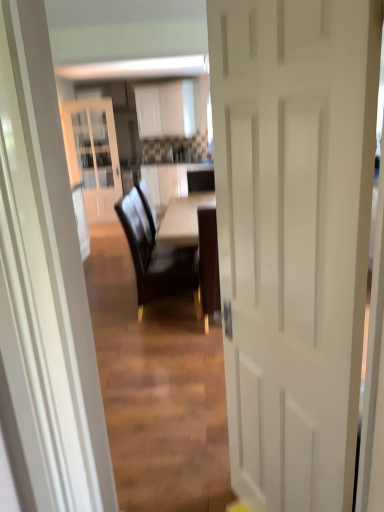
Question: Is white matte door at center bigger than dark brown leather chair at center?

Choices:
 (A) no
 (B) yes

Answer: (A)

Question: Can you confirm if white matte door at center is positioned to the left of dark brown leather chair at center?

Choices:
 (A) no
 (B) yes

Answer: (A)

Question: Would you say dark brown leather chair at center is part of white matte door at center's contents?

Choices:
 (A) yes
 (B) no

Answer: (B)

Question: From the image's perspective, would you say white matte door at center is positioned over dark brown leather chair at center?

Choices:
 (A) yes
 (B) no

Answer: (B)

Question: Is white matte door at center taller than dark brown leather chair at center?

Choices:
 (A) no
 (B) yes

Answer: (B)

Question: Is the position of white matte door at center more distant than that of dark brown leather chair at center?

Choices:
 (A) no
 (B) yes

Answer: (A)

Question: Is white matte door at center completely or partially inside dark brown leather chair at center?

Choices:
 (A) no
 (B) yes

Answer: (A)

Question: Considering the relative positions of dark brown leather chair at center and white matte door at center in the image provided, is dark brown leather chair at center to the right of white matte door at center from the viewer's perspective?

Choices:
 (A) no
 (B) yes

Answer: (A)

Question: Is dark brown leather chair at center not within white matte door at center?

Choices:
 (A) yes
 (B) no

Answer: (A)

Question: Considering the relative sizes of dark brown leather chair at center and white matte door at center in the image provided, is dark brown leather chair at center wider than white matte door at center?

Choices:
 (A) no
 (B) yes

Answer: (B)

Question: Would you consider dark brown leather chair at center to be distant from white matte door at center?

Choices:
 (A) no
 (B) yes

Answer: (B)

Question: From the image's perspective, is dark brown leather chair at center on top of white matte door at center?

Choices:
 (A) yes
 (B) no

Answer: (A)

Question: In terms of width, does dark brown leather chair at center look wider or thinner when compared to white matte door at center?

Choices:
 (A) wide
 (B) thin

Answer: (A)